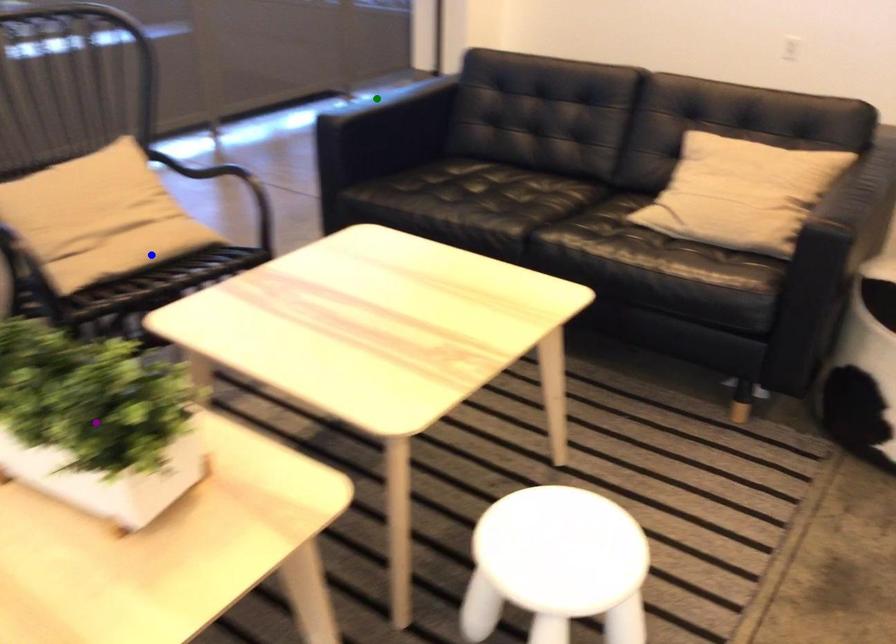
Order these from farthest to nearest:
green point | purple point | blue point

green point → blue point → purple point